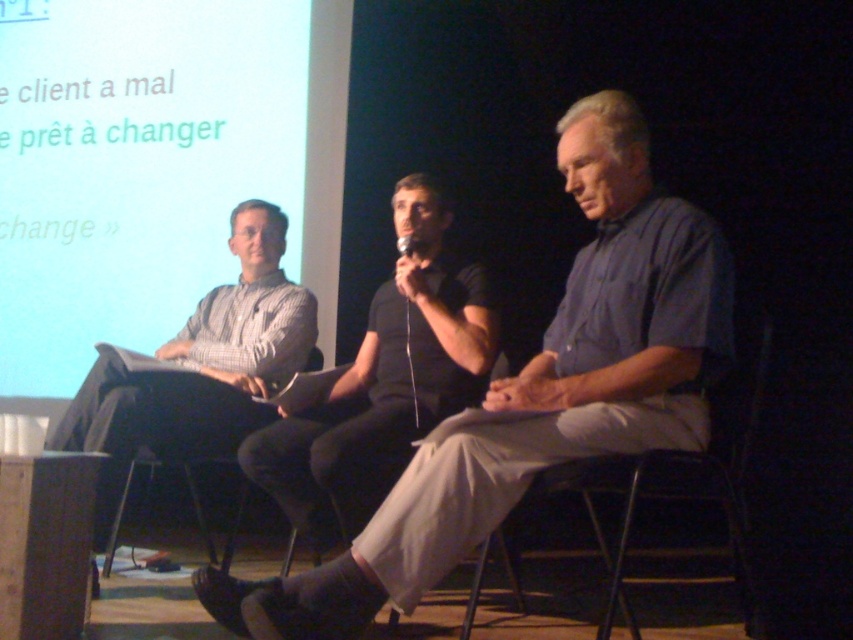
Question: Among these points, which one is nearest to the camera?

Choices:
 (A) (289, 440)
 (B) (511, 570)
 (C) (148, 465)
 (D) (281, 336)

Answer: (A)

Question: Is light blue shirt at center positioned in front of metallic gray chair at center?

Choices:
 (A) no
 (B) yes

Answer: (B)

Question: Can you confirm if metallic silver chair at center is positioned to the left of metallic gray chair at center?

Choices:
 (A) yes
 (B) no

Answer: (B)

Question: In this image, where is black matte shirt at center located relative to striped cotton shirt at left?

Choices:
 (A) left
 (B) right

Answer: (B)

Question: Which of these objects is positioned farthest from the striped cotton shirt at left?

Choices:
 (A) light blue shirt at center
 (B) fabric-covered chair at center
 (C) metallic gray chair at center

Answer: (A)

Question: Estimate the real-world distances between objects in this image. Which object is farther from the black matte shirt at center?

Choices:
 (A) light blue shirt at center
 (B) striped cotton shirt at left
 (C) metallic gray chair at center
 (D) metallic silver chair at center

Answer: (C)